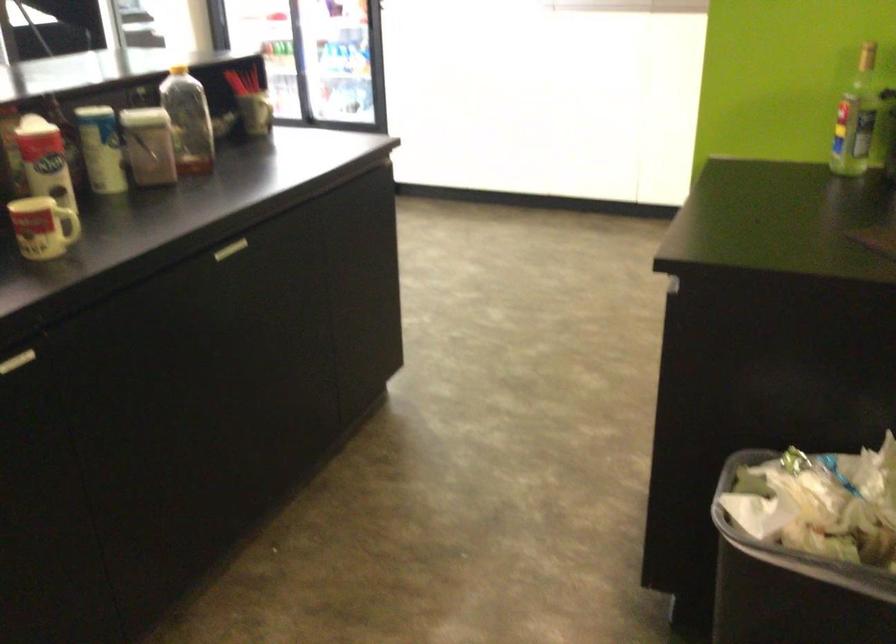
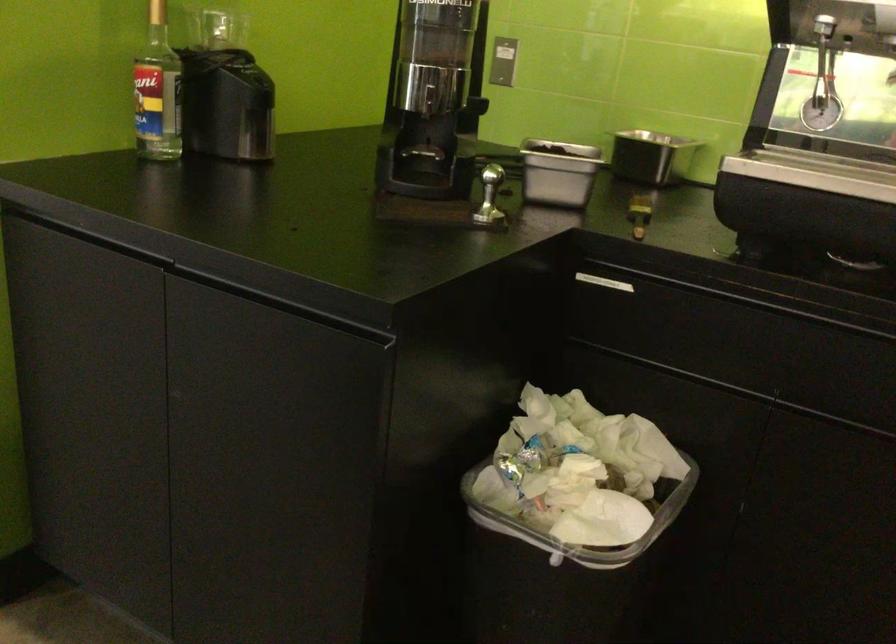
In the second image, find the point that corresponds to the point at 679,257 in the first image.

(280, 304)